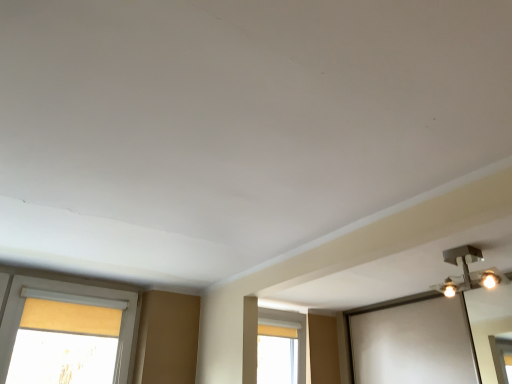
Question: Based on their sizes in the image, would you say matte yellow curtain at center is bigger or smaller than metallic silver light fixture at upper right?

Choices:
 (A) big
 (B) small

Answer: (A)

Question: Choose the correct answer: Is matte yellow curtain at center inside metallic silver light fixture at upper right or outside it?

Choices:
 (A) outside
 (B) inside

Answer: (A)

Question: Would you say matte yellow curtain at center is to the left or to the right of metallic silver light fixture at upper right in the picture?

Choices:
 (A) left
 (B) right

Answer: (A)

Question: Is metallic silver light fixture at upper right spatially inside matte yellow curtain at center, or outside of it?

Choices:
 (A) inside
 (B) outside

Answer: (B)

Question: In terms of width, does metallic silver light fixture at upper right look wider or thinner when compared to matte yellow curtain at center?

Choices:
 (A) thin
 (B) wide

Answer: (B)

Question: From the image's perspective, is metallic silver light fixture at upper right above or below matte yellow curtain at center?

Choices:
 (A) below
 (B) above

Answer: (B)

Question: Is point (503, 279) positioned closer to the camera than point (258, 370)?

Choices:
 (A) closer
 (B) farther

Answer: (A)